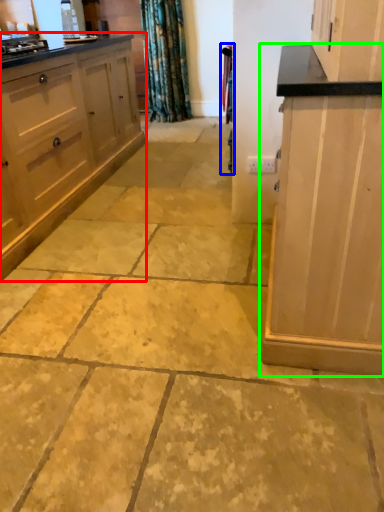
Question: Based on their relative distances, which object is nearer to cabinetry (highlighted by a red box)? Choose from curtain (highlighted by a blue box) and cabinetry (highlighted by a green box).

Choices:
 (A) curtain
 (B) cabinetry

Answer: (A)